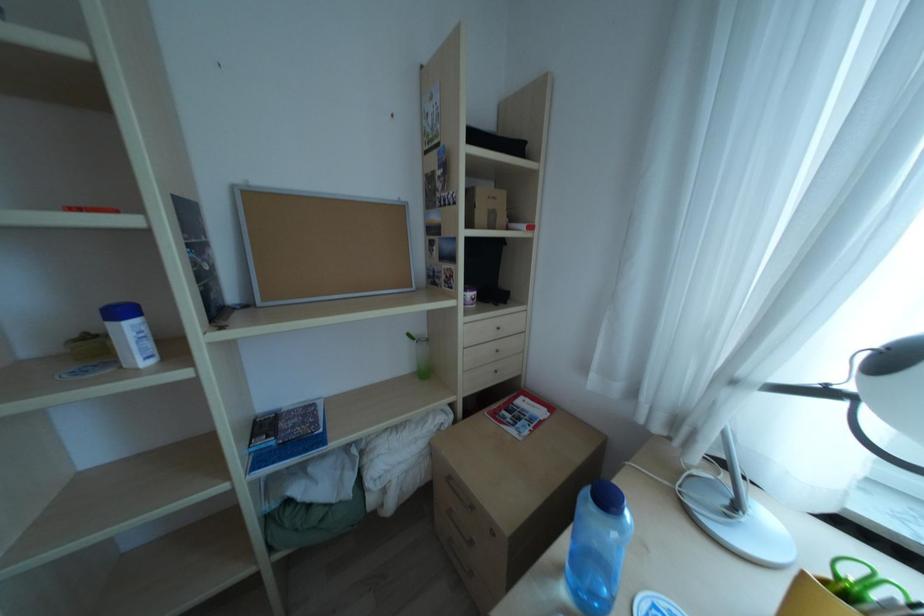
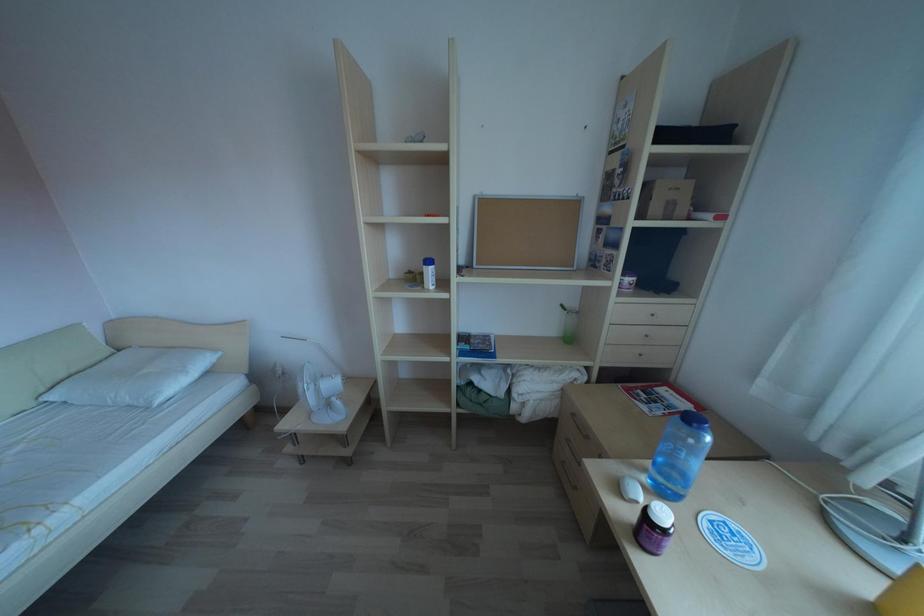
Question: The images are taken continuously from a first-person perspective. In which direction is your viewpoint rotating?

Choices:
 (A) Left
 (B) Right
 (C) Up
 (D) Down

Answer: (A)